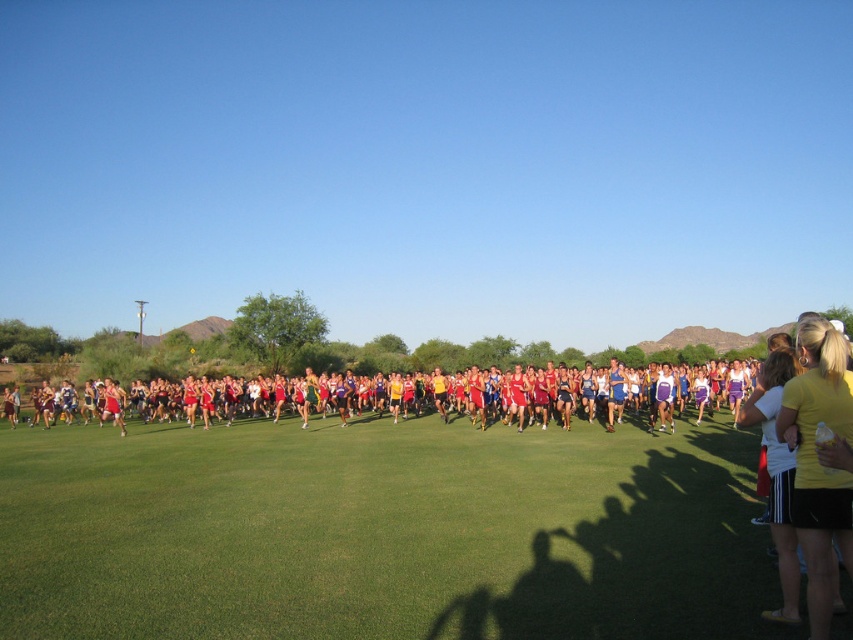
You are a photographer positioned at the starting line of the cross country race. You want to take a photo that includes both the green grass at center and the matte red shorts at center. Which object should you focus on first to ensure both are in sharp focus?

The green grass at center is closer to the viewer than the matte red shorts at center. To ensure both are in sharp focus, you should focus on the green grass at center first, as it is closer, and the matte red shorts at center will fall within the depth of field.

You are a runner in the cross country race and you want to reach the finish line located at the yellow fabric at right. Which direction should you move relative to the green grass at center?

Since the green grass at center is positioned on the left side of yellow fabric at right, you should move to the right from the green grass at center to reach the yellow fabric at right.

You are a photographer positioned at the center of the field. You want to capture a photo that includes both the yellow fabric at right and the matte red shorts at center. Which object should you adjust your camera angle to focus on first to ensure both are in frame?

Since the yellow fabric at right is located above the matte red shorts at center, you should first adjust your camera angle to focus on the yellow fabric at right to ensure both objects are in frame.